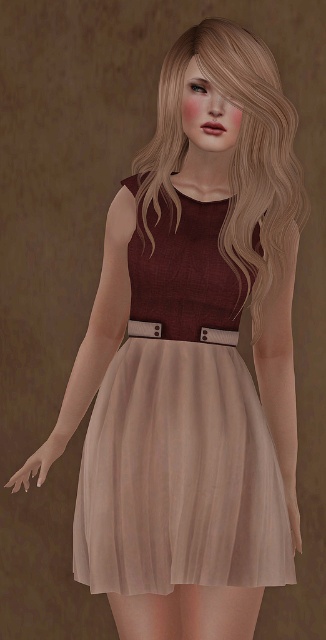
You are a fashion designer observing the image. You need to decide which item, the blondehair at center or the metallic silver belt at center, requires more space when designing a dress that accommodates both. Based on the image, which one should you prioritize for space?

The blondehair at center might be wider than metallic silver belt at center, so you should prioritize the blondehair at center for space when designing the dress.

You are a fashion designer observing the image. You need to determine the placement of the metallic silver belt at center relative to the blondehair at center. Based on the scene, is the belt placed above or below the hair?

The blondehair at center is located above the metallic silver belt at center, so the belt is placed below the hair.

You are a photographer standing in front of the person with blondehair at center. You want to take a portrait but need to ensure you are within the recommended 1.5 meters personal space boundary. Are you positioned correctly?

The distance between you and the blondehair at center is 1.55 meters, which is just slightly beyond the recommended 1.5 meters personal space boundary. You should move a tiny bit closer to stay within the recommended distance.